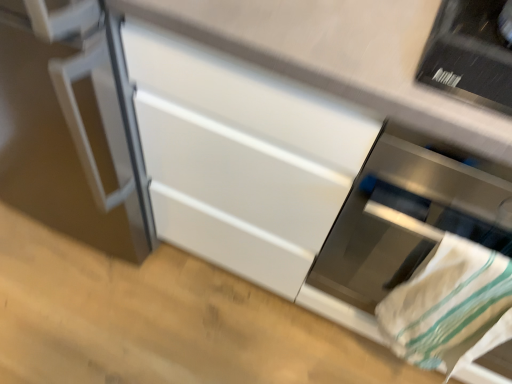
What do you see at coordinates (410, 214) in the screenshot? I see `stainless steel oven at lower right` at bounding box center [410, 214].

In order to face stainless steel oven at lower right, should I rotate leftwards or rightwards?

You should look right and rotate roughly 27.737 degrees.

The width and height of the screenshot is (512, 384). I want to click on stainless steel oven at lower right, so click(x=410, y=214).

Locate an element on the screen. white cotton towel at lower right is located at coordinates (450, 306).

Describe the element at coordinates (450, 306) in the screenshot. I see `white cotton towel at lower right` at that location.

Locate an element on the screen. This screenshot has width=512, height=384. stainless steel oven at lower right is located at coordinates (410, 214).

Which object is positioned more to the left, stainless steel oven at lower right or white cotton towel at lower right?

white cotton towel at lower right is more to the left.

Who is more distant, stainless steel oven at lower right or white cotton towel at lower right?

white cotton towel at lower right is further from the camera.

Does point (354, 254) come in front of point (487, 319)?

No.

From the image's perspective, between stainless steel oven at lower right and white cotton towel at lower right, which one is located above?

stainless steel oven at lower right is shown above in the image.

From a real-world perspective, is stainless steel oven at lower right physically above white cotton towel at lower right?

Indeed, from a real-world perspective, stainless steel oven at lower right stands above white cotton towel at lower right.

In terms of width, does stainless steel oven at lower right look wider or thinner when compared to white cotton towel at lower right?

Considering their sizes, stainless steel oven at lower right looks broader than white cotton towel at lower right.

Considering the relative sizes of stainless steel oven at lower right and white cotton towel at lower right in the image provided, is stainless steel oven at lower right taller than white cotton towel at lower right?

Yes.

From the picture: Who is smaller, stainless steel oven at lower right or white cotton towel at lower right?

With smaller size is white cotton towel at lower right.

Is stainless steel oven at lower right completely or partially outside of white cotton towel at lower right?

stainless steel oven at lower right lies outside white cotton towel at lower right's area.

Is stainless steel oven at lower right with white cotton towel at lower right?

stainless steel oven at lower right and white cotton towel at lower right are not in contact.

Is stainless steel oven at lower right oriented towards white cotton towel at lower right?

Yes, stainless steel oven at lower right is facing white cotton towel at lower right.

What's the angular difference between stainless steel oven at lower right and white cotton towel at lower right's facing directions?

The facing directions of stainless steel oven at lower right and white cotton towel at lower right are 9.4e-05 degrees apart.

I want to click on oven that is on the right side of white cotton towel at lower right, so click(x=410, y=214).

Is white cotton towel at lower right at the right side of stainless steel oven at lower right?

No.

Relative to stainless steel oven at lower right, is white cotton towel at lower right in front or behind?

Clearly, white cotton towel at lower right is behind stainless steel oven at lower right.

Between point (476, 299) and point (337, 261), which one is positioned in front?

The point (476, 299) is more forward.

In the scene shown: From the image's perspective, which is above, white cotton towel at lower right or stainless steel oven at lower right?

From the image's view, stainless steel oven at lower right is above.

From a real-world perspective, which object stands above the other?

stainless steel oven at lower right is physically above.

Can you confirm if white cotton towel at lower right is wider than stainless steel oven at lower right?

Incorrect, the width of white cotton towel at lower right does not surpass that of stainless steel oven at lower right.

From the picture: Is white cotton towel at lower right taller or shorter than stainless steel oven at lower right?

In the image, white cotton towel at lower right appears to be shorter than stainless steel oven at lower right.

Between white cotton towel at lower right and stainless steel oven at lower right, which one has smaller size?

With smaller size is white cotton towel at lower right.

Based on the photo, is white cotton towel at lower right not inside stainless steel oven at lower right?

No, most part of white cotton towel at lower right lies within stainless steel oven at lower right.

Is white cotton towel at lower right beside stainless steel oven at lower right?

No, white cotton towel at lower right is not touching stainless steel oven at lower right.

Is white cotton towel at lower right oriented towards stainless steel oven at lower right?

Yes, white cotton towel at lower right is aimed at stainless steel oven at lower right.

What's the angular difference between white cotton towel at lower right and stainless steel oven at lower right's facing directions?

The angle between the facing direction of white cotton towel at lower right and the facing direction of stainless steel oven at lower right is 9.4e-05 degrees.

Locate an element on the screen. This screenshot has width=512, height=384. oven above the white cotton towel at lower right (from a real-world perspective) is located at coordinates (410, 214).

Find the location of `blanket below the stainless steel oven at lower right (from the image's perspective)`. blanket below the stainless steel oven at lower right (from the image's perspective) is located at coordinates (450, 306).

Locate an element on the screen. This screenshot has width=512, height=384. oven in front of the white cotton towel at lower right is located at coordinates (410, 214).